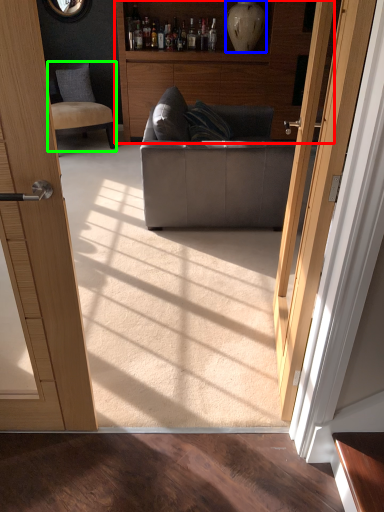
Question: Estimate the real-world distances between objects in this image. Which object is farther from cabinetry (highlighted by a red box), vase (highlighted by a blue box) or chair (highlighted by a green box)?

Choices:
 (A) vase
 (B) chair

Answer: (B)